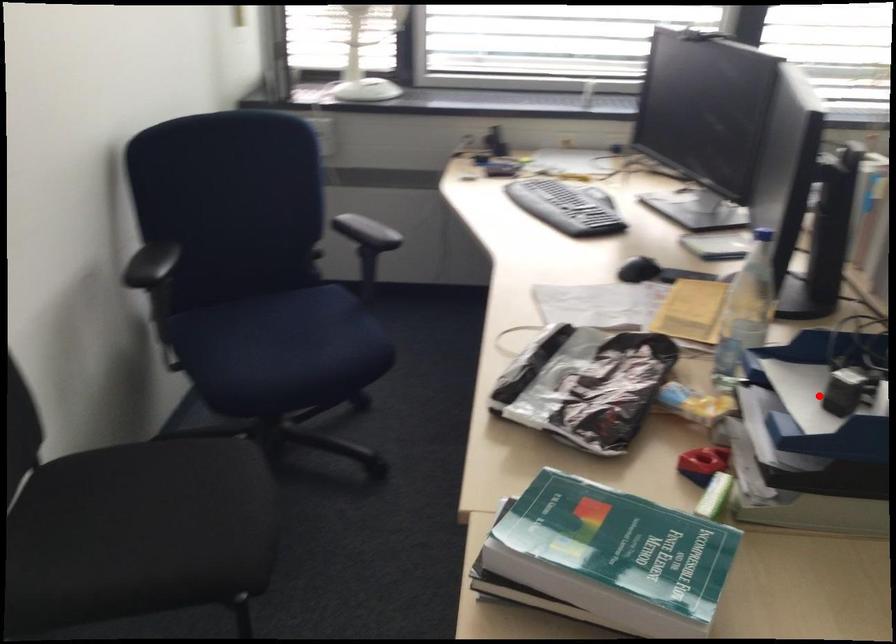
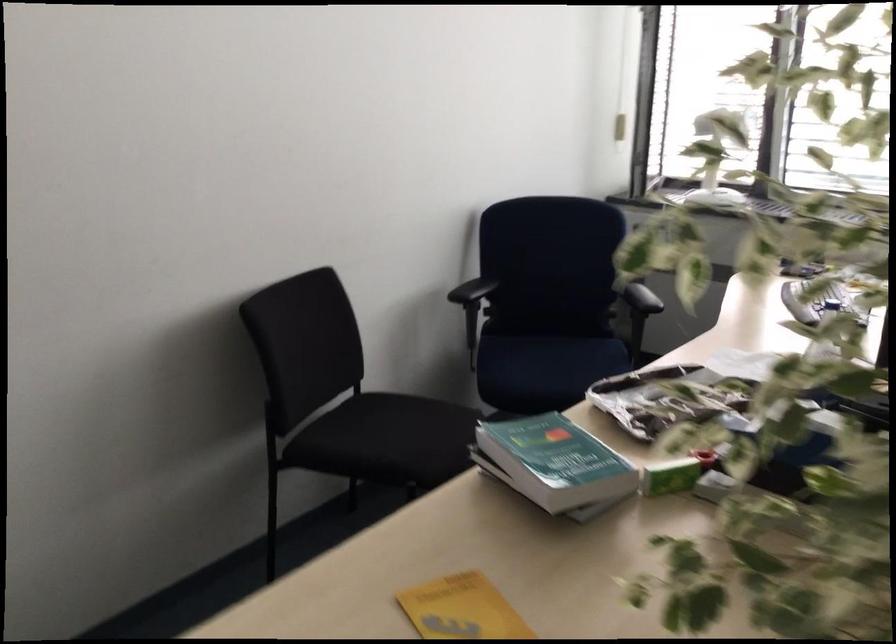
Question: I am providing you with two images of the same scene from different viewpoints. A red point is marked on the first image. Is the red point's position out of view in image 2?

Choices:
 (A) Yes
 (B) No

Answer: (A)